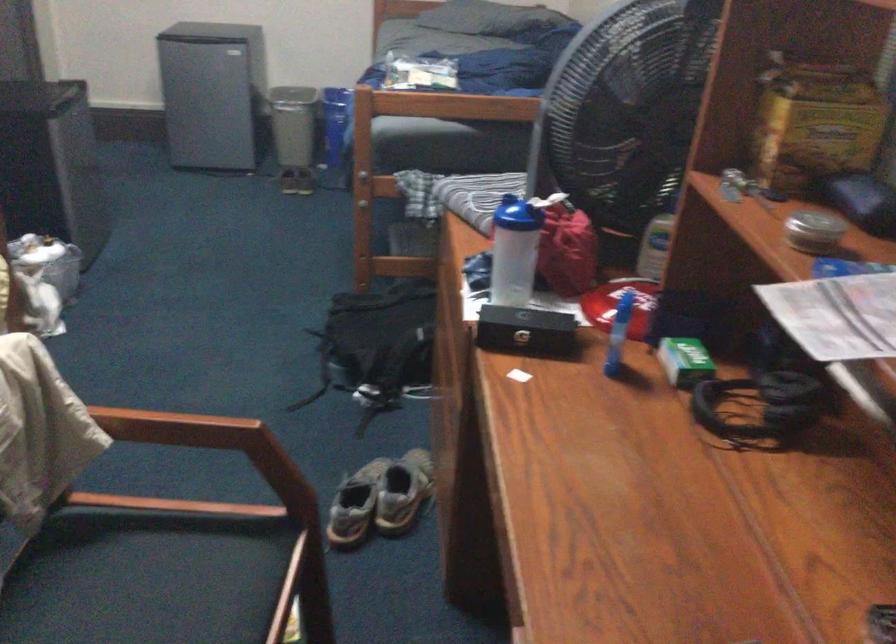
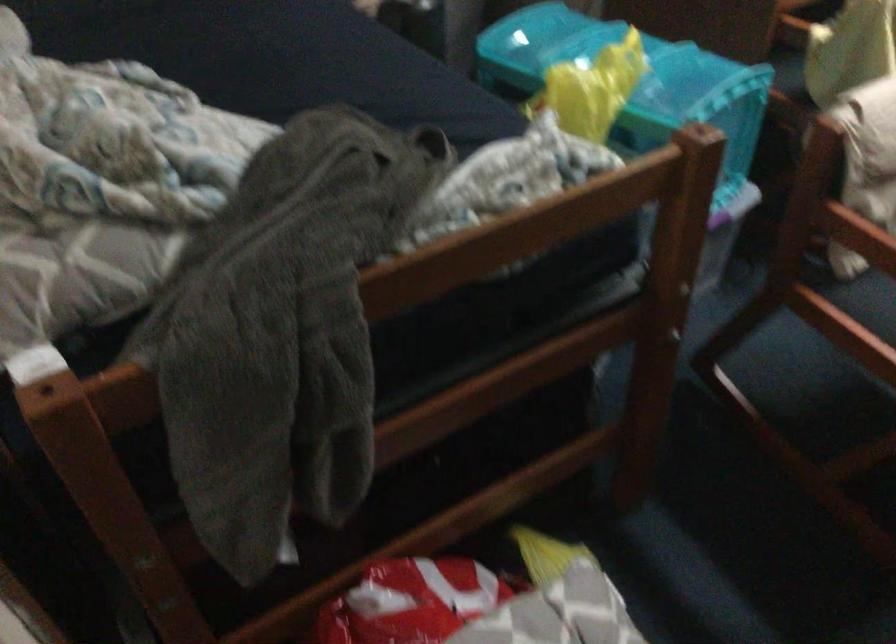
The first image is from the beginning of the video and the second image is from the end. How did the camera likely rotate when shooting the video?

The camera rotated toward left-down.